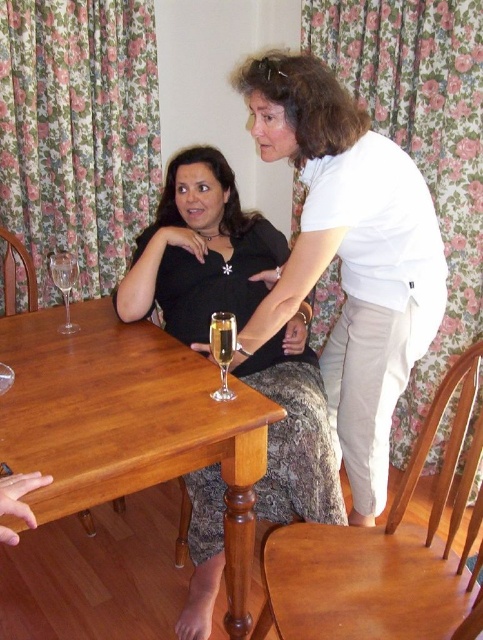
Question: Does wooden table at center appear on the right side of clear glass wine glass at table left?

Choices:
 (A) yes
 (B) no

Answer: (A)

Question: Can you confirm if white matte shirt at upper center is positioned to the right of clear glass champagne at table center?

Choices:
 (A) no
 (B) yes

Answer: (B)

Question: Which object appears farthest from the camera in this image?

Choices:
 (A) clear glass wine glass at table
 (B) clear glass champagne at table center

Answer: (A)

Question: Considering the real-world distances, which object is farthest from the clear glass wine glass at table left?

Choices:
 (A) wooden table at center
 (B) clear glass champagne at table center

Answer: (B)

Question: Which point is closer to the camera?

Choices:
 (A) white matte shirt at upper center
 (B) black matte dress at center
 (C) wooden table at center
 (D) clear glass wine glass at table left

Answer: (C)

Question: Can you confirm if wooden table at center is bigger than clear glass wine glass at table?

Choices:
 (A) yes
 (B) no

Answer: (A)